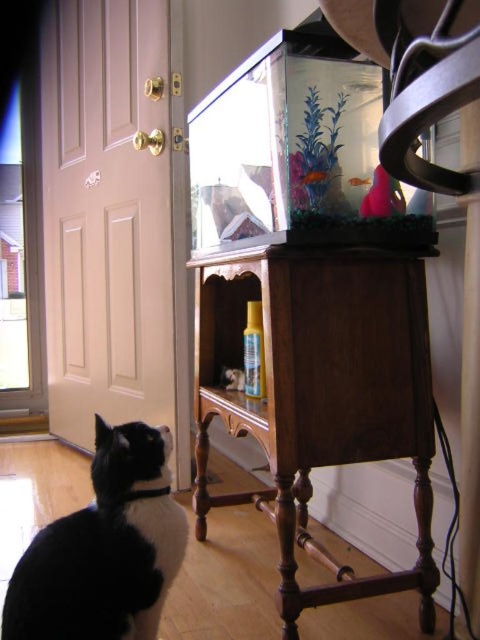
Question: Does matte white door at left have a greater width compared to translucent glass fish at center?

Choices:
 (A) no
 (B) yes

Answer: (B)

Question: Which object is closer to the camera taking this photo?

Choices:
 (A) wooden at center
 (B) translucent glass fish at center
 (C) black fur cat at lower left

Answer: (C)

Question: Is wooden at center behind pink matte fish at upper center?

Choices:
 (A) no
 (B) yes

Answer: (A)

Question: Does wooden at center appear on the right side of matte white door at left?

Choices:
 (A) no
 (B) yes

Answer: (B)

Question: Which object appears closest to the camera in this image?

Choices:
 (A) wooden at center
 (B) black fur cat at lower left
 (C) translucent glass fish at center

Answer: (B)

Question: Estimate the real-world distances between objects in this image. Which object is farther from the black fur cat at lower left?

Choices:
 (A) pink matte fish at upper center
 (B) translucent glass fish at center
 (C) matte white door at left
 (D) wooden at center

Answer: (C)